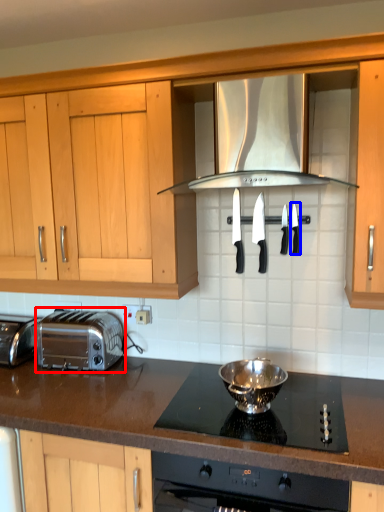
Question: Which of the following is the farthest to the observer, toaster (highlighted by a red box) or kitchen appliance (highlighted by a blue box)?

Choices:
 (A) toaster
 (B) kitchen appliance

Answer: (A)